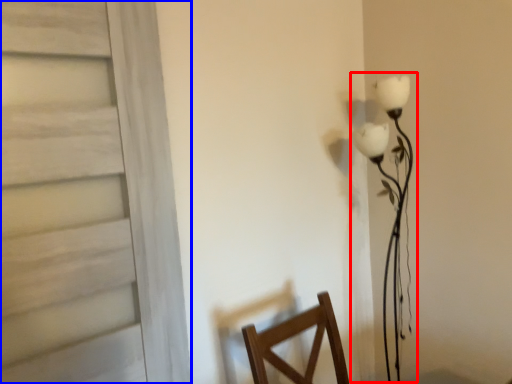
Question: Which object appears farthest to the camera in this image, table lamp (highlighted by a red box) or door (highlighted by a blue box)?

Choices:
 (A) table lamp
 (B) door

Answer: (A)